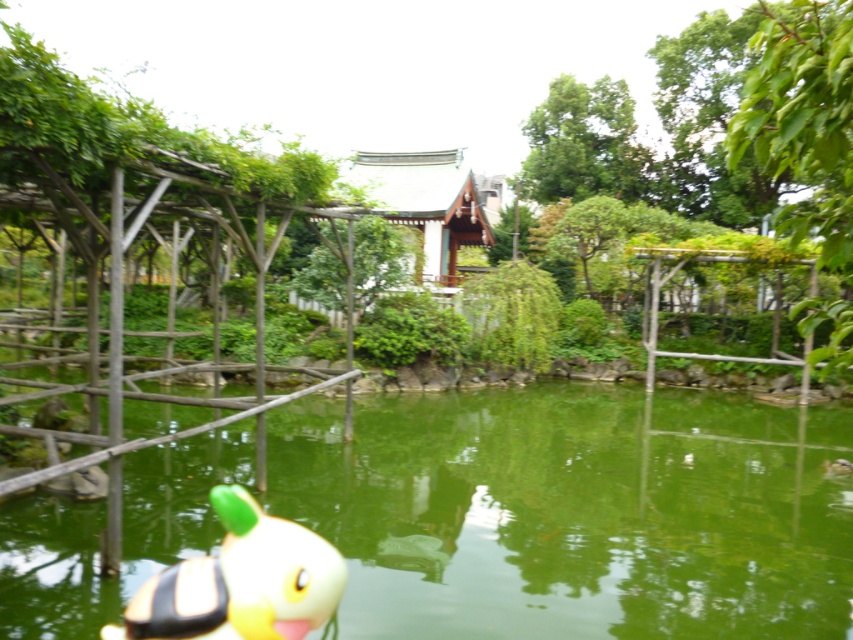
Question: Can you confirm if green liquid water at center is wider than yellow rubber duck at lower left?

Choices:
 (A) yes
 (B) no

Answer: (A)

Question: Does green liquid water at center come in front of yellow rubber duck at lower left?

Choices:
 (A) yes
 (B) no

Answer: (B)

Question: Does green liquid water at center appear on the right side of yellow rubber duck at lower left?

Choices:
 (A) yes
 (B) no

Answer: (A)